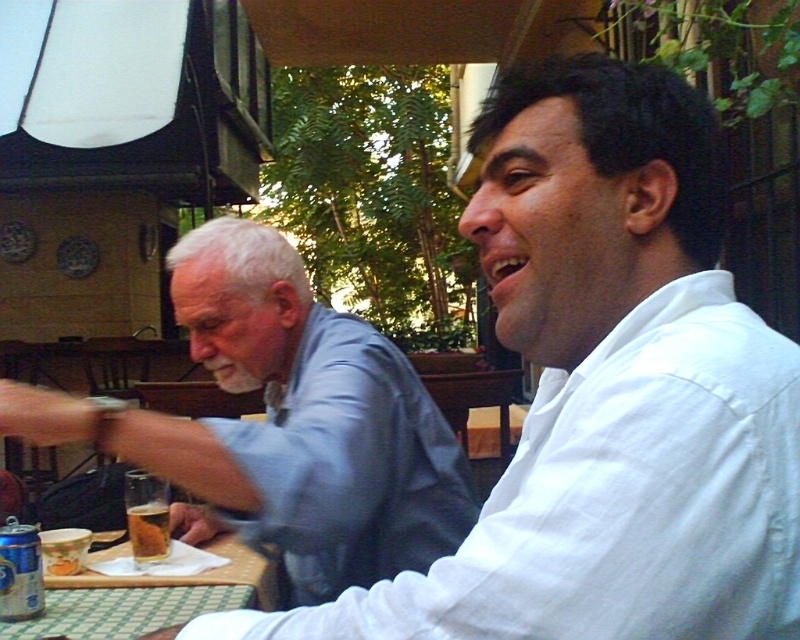
Question: Can you confirm if blue cotton shirt at upper left is positioned above golden crispy fries at lower left?

Choices:
 (A) no
 (B) yes

Answer: (B)

Question: Can you confirm if blue cotton shirt at upper left is smaller than golden crispy fries at lower left?

Choices:
 (A) yes
 (B) no

Answer: (B)

Question: Which of the following is the closest to the observer?

Choices:
 (A) pyautogui.click(x=2, y=548)
 (B) pyautogui.click(x=44, y=561)
 (C) pyautogui.click(x=333, y=438)

Answer: (C)

Question: Which of the following is the farthest from the observer?

Choices:
 (A) white cotton shirt at upper right
 (B) blue cotton shirt at upper left
 (C) golden crispy fries at lower left
 (D) blue metallic can at lower left

Answer: (C)

Question: Does blue cotton shirt at upper left appear over green checkered tablecloth at lower left?

Choices:
 (A) no
 (B) yes

Answer: (B)

Question: Considering the real-world distances, which object is farthest from the translucent glass beer at lower left?

Choices:
 (A) blue metallic can at lower left
 (B) golden crispy fries at lower left
 (C) blue cotton shirt at upper left
 (D) green checkered tablecloth at lower left

Answer: (C)